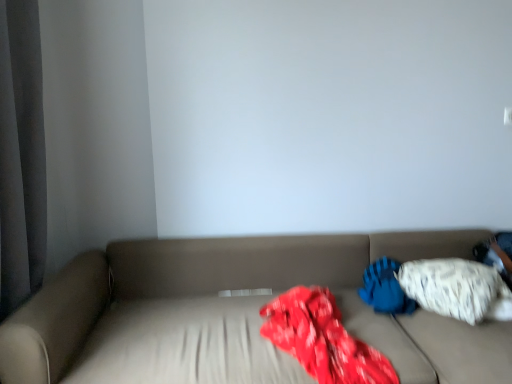
Question: Is white textured pillow at right, placed as the second pillow when sorted from left to right, to the left of beige fabric couch at center from the viewer's perspective?

Choices:
 (A) yes
 (B) no

Answer: (B)

Question: From the image's perspective, is white textured pillow at right, placed as the second pillow when sorted from left to right, on beige fabric couch at center?

Choices:
 (A) no
 (B) yes

Answer: (B)

Question: Does white textured pillow at right, placed as the first pillow when sorted from right to left, have a lesser width compared to beige fabric couch at center?

Choices:
 (A) yes
 (B) no

Answer: (A)

Question: Is white textured pillow at right, placed as the second pillow when sorted from left to right, outside of beige fabric couch at center?

Choices:
 (A) no
 (B) yes

Answer: (B)

Question: Is the surface of white textured pillow at right, placed as the second pillow when sorted from left to right, in direct contact with beige fabric couch at center?

Choices:
 (A) yes
 (B) no

Answer: (B)

Question: From the image's perspective, is white textured pillow at right, placed as the second pillow when sorted from left to right, above or below beige fabric couch at center?

Choices:
 (A) below
 (B) above

Answer: (B)

Question: Relative to beige fabric couch at center, is white textured pillow at right, placed as the first pillow when sorted from right to left, in front or behind?

Choices:
 (A) behind
 (B) front

Answer: (A)

Question: In the image, is white textured pillow at right, placed as the second pillow when sorted from left to right, on the left side or the right side of beige fabric couch at center?

Choices:
 (A) left
 (B) right

Answer: (B)

Question: From a real-world perspective, is white textured pillow at right, placed as the second pillow when sorted from left to right, positioned above or below beige fabric couch at center?

Choices:
 (A) above
 (B) below

Answer: (A)

Question: Is white soft pillow at right, marked as the 2th pillow in a right-to-left arrangement, spatially inside beige fabric couch at center, or outside of it?

Choices:
 (A) inside
 (B) outside

Answer: (A)

Question: Based on their positions, is white soft pillow at right, marked as the 2th pillow in a right-to-left arrangement, located to the left or right of beige fabric couch at center?

Choices:
 (A) left
 (B) right

Answer: (B)

Question: In the image, is white soft pillow at right, marked as the 2th pillow in a right-to-left arrangement, positioned in front of or behind beige fabric couch at center?

Choices:
 (A) front
 (B) behind

Answer: (B)

Question: In terms of size, does white soft pillow at right, acting as the first pillow starting from the left, appear bigger or smaller than beige fabric couch at center?

Choices:
 (A) big
 (B) small

Answer: (B)

Question: In terms of height, does beige fabric couch at center look taller or shorter compared to white soft pillow at right, marked as the 2th pillow in a right-to-left arrangement?

Choices:
 (A) short
 (B) tall

Answer: (B)

Question: Considering the positions of point (35, 302) and point (410, 299), is point (35, 302) closer or farther from the camera than point (410, 299)?

Choices:
 (A) closer
 (B) farther

Answer: (A)